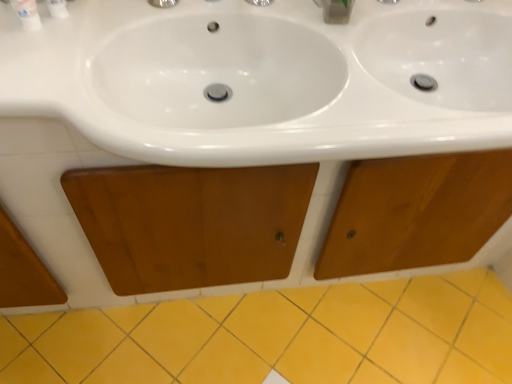
Find the location of a particular element. Image resolution: width=512 pixels, height=384 pixels. vacant space to the right of white plastic toothpaste tube at upper left is located at coordinates (125, 26).